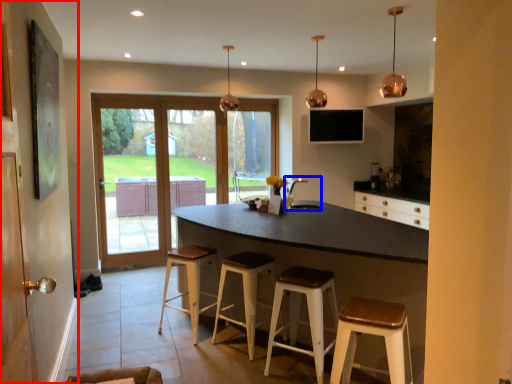
Question: Which point is further to the camera, side (highlighted by a red box) or sink (highlighted by a blue box)?

Choices:
 (A) side
 (B) sink

Answer: (B)